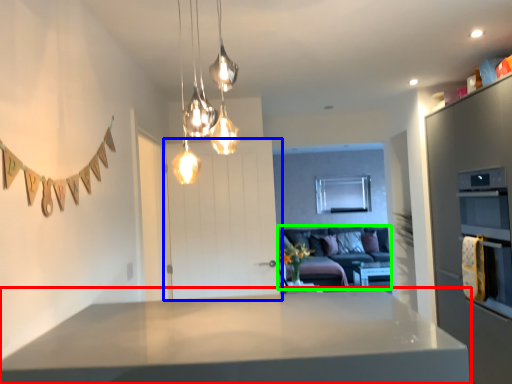
Question: Which is farther away from countertop (highlighted by a red box)? door (highlighted by a blue box) or couch (highlighted by a green box)?

Choices:
 (A) door
 (B) couch

Answer: (B)